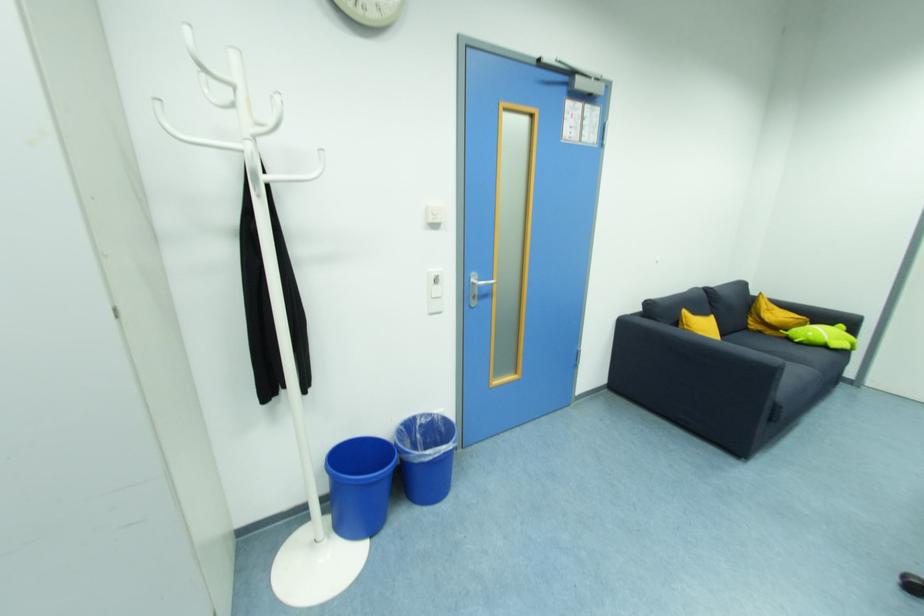
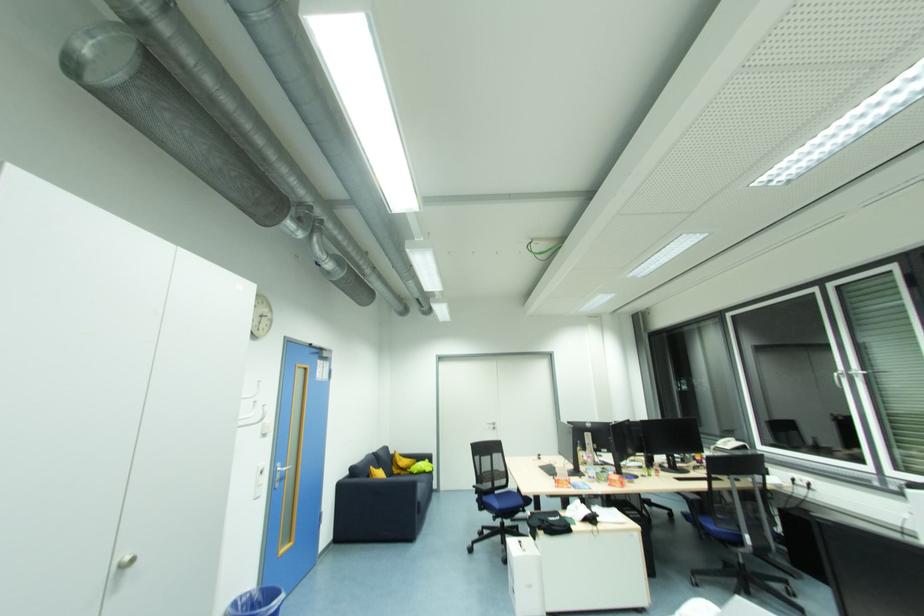
Where in the second image is the point corresponding to point 844,328 from the first image?

(430, 461)